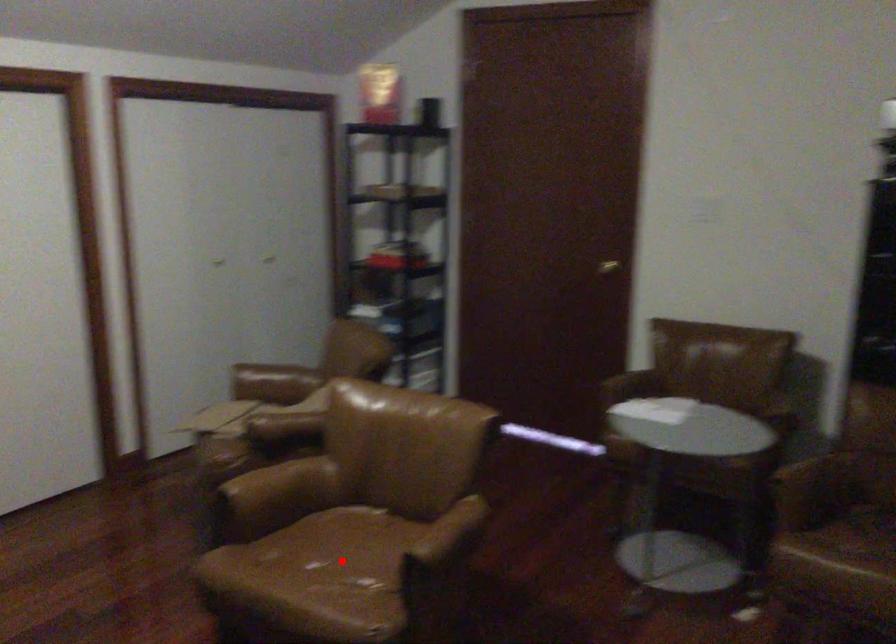
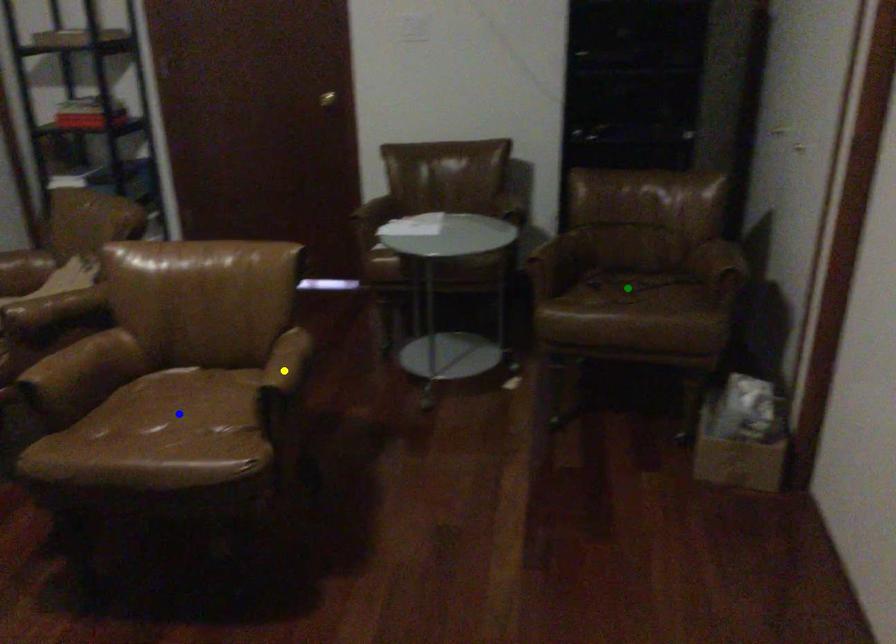
Question: I am providing you with two images of the same scene from different viewpoints. A red point is marked on the first image. You are given multiple points on the second image. Which point in image 2 is actually the same real-world point as the red point in image 1?

Choices:
 (A) yellow point
 (B) blue point
 (C) green point

Answer: (B)